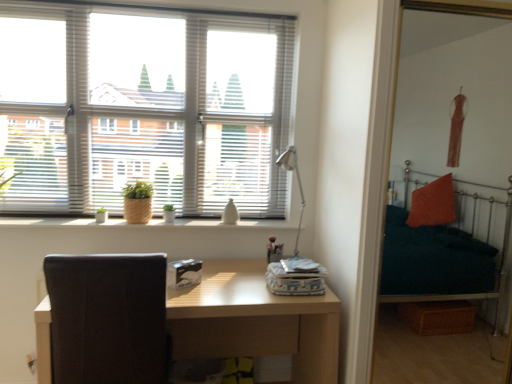
Question: Can you see black leather swivel chair at left touching metallic silver table lamp at center?

Choices:
 (A) no
 (B) yes

Answer: (A)

Question: Would you say black leather swivel chair at left contains metallic silver table lamp at center?

Choices:
 (A) no
 (B) yes

Answer: (A)

Question: Does black leather swivel chair at left have a greater height compared to metallic silver table lamp at center?

Choices:
 (A) yes
 (B) no

Answer: (A)

Question: Does black leather swivel chair at left appear on the left side of metallic silver table lamp at center?

Choices:
 (A) no
 (B) yes

Answer: (B)

Question: Is black leather swivel chair at left smaller than metallic silver table lamp at center?

Choices:
 (A) no
 (B) yes

Answer: (A)

Question: In the image, is braided straw pot at window on the left side or the right side of light brown wooden table at center?

Choices:
 (A) left
 (B) right

Answer: (A)

Question: Considering the positions of braided straw pot at window and light brown wooden table at center in the image, is braided straw pot at window wider or thinner than light brown wooden table at center?

Choices:
 (A) wide
 (B) thin

Answer: (B)

Question: Is point (129, 210) positioned closer to the camera than point (230, 322)?

Choices:
 (A) farther
 (B) closer

Answer: (A)

Question: From their relative heights in the image, would you say braided straw pot at window is taller or shorter than light brown wooden table at center?

Choices:
 (A) short
 (B) tall

Answer: (A)

Question: Considering the positions of black leather swivel chair at left and wooden textured window sill at center in the image, is black leather swivel chair at left taller or shorter than wooden textured window sill at center?

Choices:
 (A) tall
 (B) short

Answer: (A)

Question: In terms of width, does black leather swivel chair at left look wider or thinner when compared to wooden textured window sill at center?

Choices:
 (A) wide
 (B) thin

Answer: (A)

Question: Based on their positions, is black leather swivel chair at left located to the left or right of wooden textured window sill at center?

Choices:
 (A) left
 (B) right

Answer: (A)

Question: Is point (114, 342) closer or farther from the camera than point (245, 226)?

Choices:
 (A) closer
 (B) farther

Answer: (A)

Question: Based on their positions, is light brown wooden table at center located to the left or right of black leather swivel chair at left?

Choices:
 (A) right
 (B) left

Answer: (A)

Question: Considering the positions of point (225, 276) and point (140, 336), is point (225, 276) closer or farther from the camera than point (140, 336)?

Choices:
 (A) farther
 (B) closer

Answer: (A)